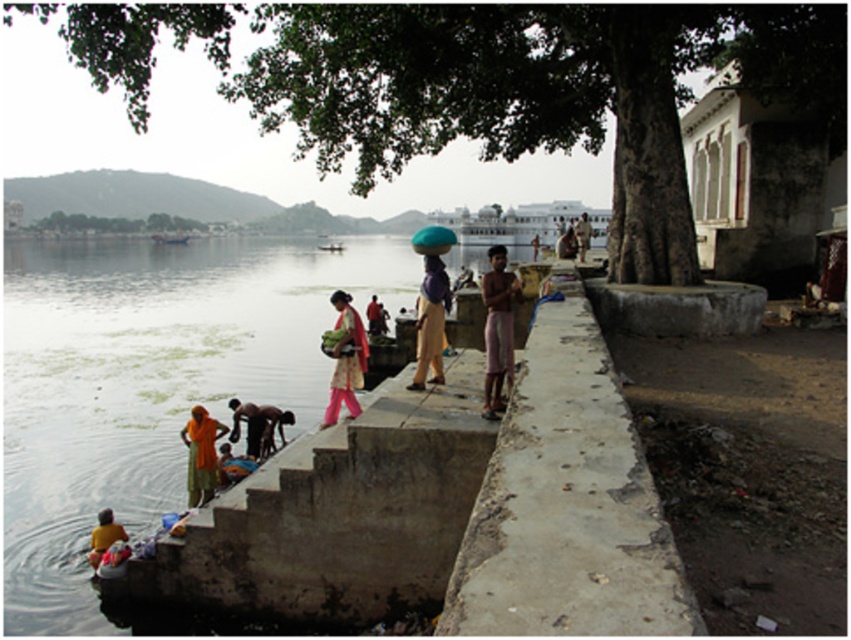
You are a photographer standing at the riverside ghat. You notice two elements in the lower left corner of your frame. One is dark brown skin at lower left, and the other is yellow fabric at lower left. Which of these two elements is positioned more to the right in your view?

The dark brown skin at lower left is positioned more to the right compared to the yellow fabric at lower left.

You are a tourist standing at the riverside ghat and want to take a photo of the dark brown skin at lower left and the yellow fabric at lower left. If your camera has a zoom lens that can focus up to 10 meters, will you be able to capture both subjects clearly in the same frame without moving closer?

The dark brown skin at lower left is 10.91 meters from yellow fabric at lower left. Since the distance between them exceeds the camera lens focus range of 10 meters, you won not be able to capture both subjects clearly in the same frame without moving closer.